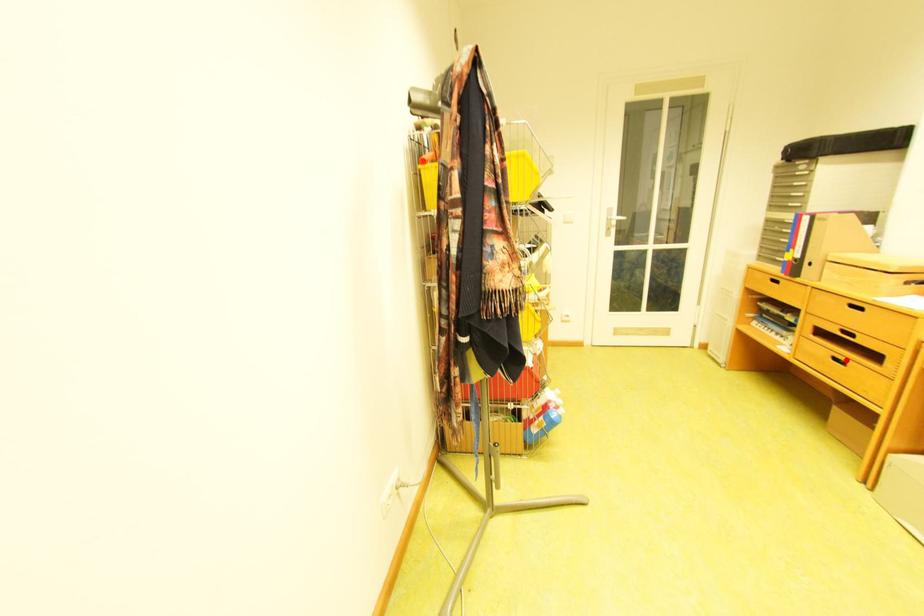
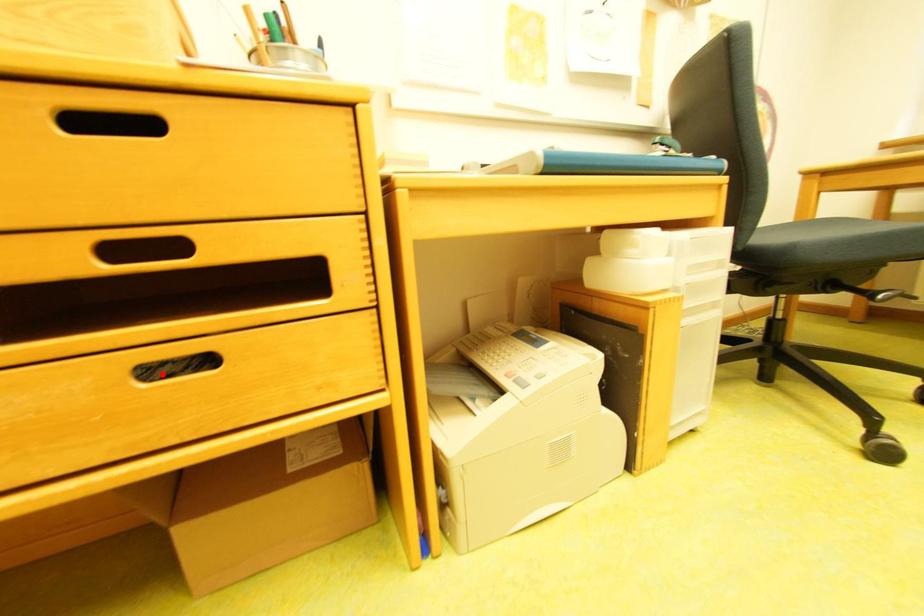
I am providing you with two images of the same scene from different viewpoints. A red point is marked on the first image and another point is marked on the second image. Does the point marked in image1 correspond to the same location as the one in image2?

Yes